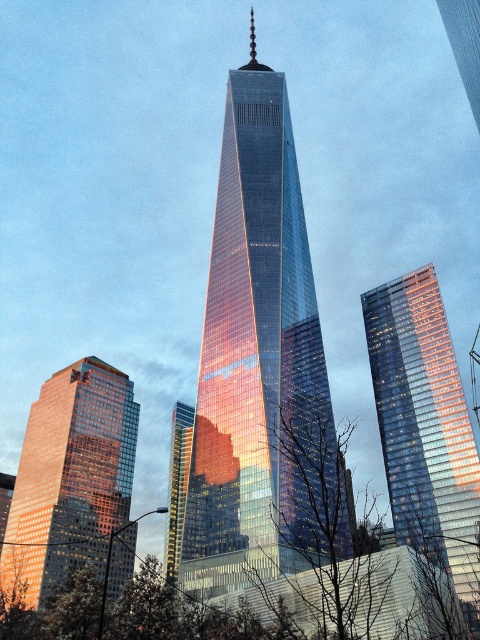
Can you confirm if glassy reflective skyscraper at right is positioned to the right of gold reflective glass skyscraper at center?

Indeed, glassy reflective skyscraper at right is positioned on the right side of gold reflective glass skyscraper at center.

Between glassy reflective skyscraper at right and gold reflective glass skyscraper at center, which one appears on the left side from the viewer's perspective?

Positioned to the left is gold reflective glass skyscraper at center.

The image size is (480, 640). Describe the element at coordinates (425, 429) in the screenshot. I see `glassy reflective skyscraper at right` at that location.

This screenshot has width=480, height=640. Identify the location of glassy reflective skyscraper at right. (425, 429).

Between shiny glass skyscraper at center and gold reflective glass skyscraper at center, which one has less height?

gold reflective glass skyscraper at center is shorter.

Does point (287, 396) lie behind point (193, 408)?

No, (287, 396) is closer to viewer.

What do you see at coordinates (260, 365) in the screenshot?
I see `shiny glass skyscraper at center` at bounding box center [260, 365].

Find the location of a particular element. shiny glass skyscraper at center is located at coordinates [x=260, y=365].

Who is taller, shiny glass skyscraper at center or shiny glass skyscraper at lower left?

shiny glass skyscraper at center is taller.

The image size is (480, 640). What do you see at coordinates (260, 365) in the screenshot?
I see `shiny glass skyscraper at center` at bounding box center [260, 365].

Which is behind, point (252, 310) or point (90, 424)?

The point (90, 424) is behind.

This screenshot has width=480, height=640. Identify the location of shiny glass skyscraper at center. (260, 365).